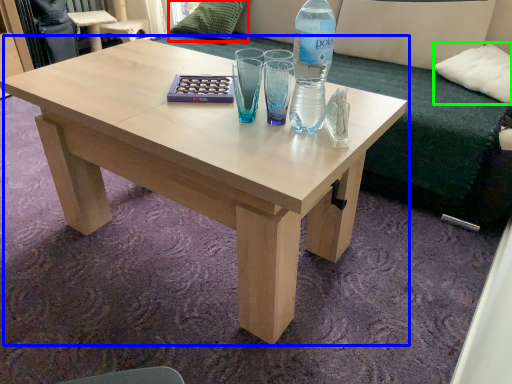
Question: Which is farther away from pillow (highlighted by a red box)? coffee table (highlighted by a blue box) or pillow (highlighted by a green box)?

Choices:
 (A) coffee table
 (B) pillow

Answer: (B)